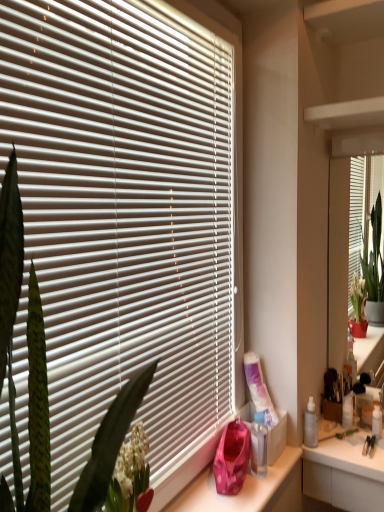
You are a GUI agent. You are given a task and a screenshot of the screen. Output one action in this format:
    pyautogui.click(x=<x>, y=<y>)
    Task: Click on the vacant space in front of matte white mirror at right
    
    Given the screenshot: What is the action you would take?
    pyautogui.click(x=352, y=446)